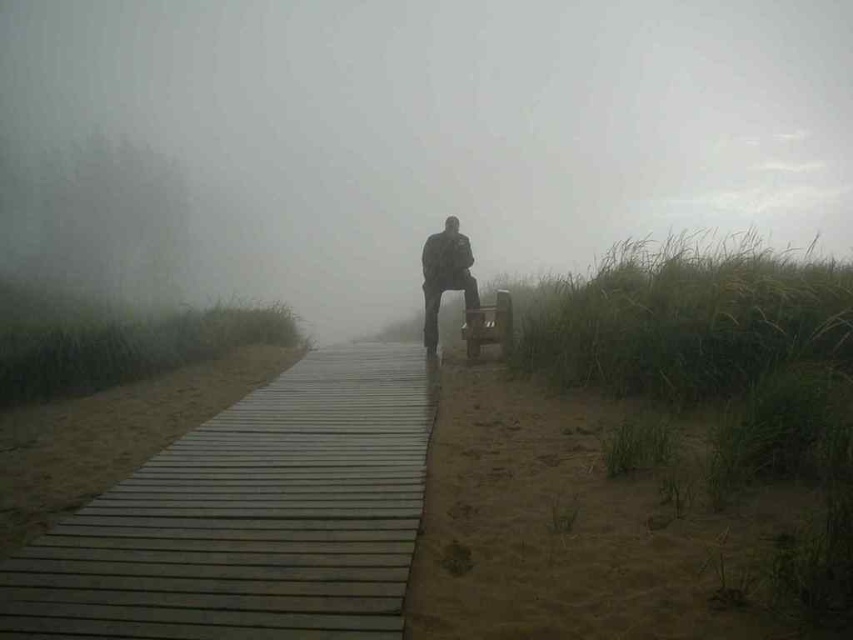
Who is positioned more to the right, foggy atmosphere at center or wooden baby carriage at center?

foggy atmosphere at center is more to the right.

Is foggy atmosphere at center positioned before wooden baby carriage at center?

Yes.

Is point (196, 180) positioned behind point (483, 333)?

That is True.

Where is `foggy atmosphere at center`? This screenshot has height=640, width=853. foggy atmosphere at center is located at coordinates (405, 138).

Does wooden at center have a greater width compared to brown sandy ground at lower right?

In fact, wooden at center might be narrower than brown sandy ground at lower right.

Between point (386, 545) and point (616, 557), which one is positioned behind?

The point (386, 545) is behind.

Is point (236, 516) closer to viewer compared to point (570, 582)?

No, it is behind (570, 582).

Find the location of a particular element. This screenshot has width=853, height=640. wooden at center is located at coordinates (250, 518).

Is wooden at center shorter than dark gray fabric jacket at center?

Yes.

Which is below, wooden at center or dark gray fabric jacket at center?

wooden at center

Which is in front, point (320, 465) or point (422, 264)?

Positioned in front is point (320, 465).

Identify the location of wooden at center. Image resolution: width=853 pixels, height=640 pixels. pyautogui.click(x=250, y=518).